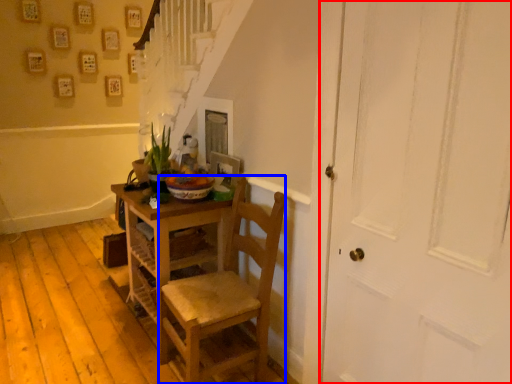
Question: Which point is further to the camera, door (highlighted by a red box) or chair (highlighted by a blue box)?

Choices:
 (A) door
 (B) chair

Answer: (B)